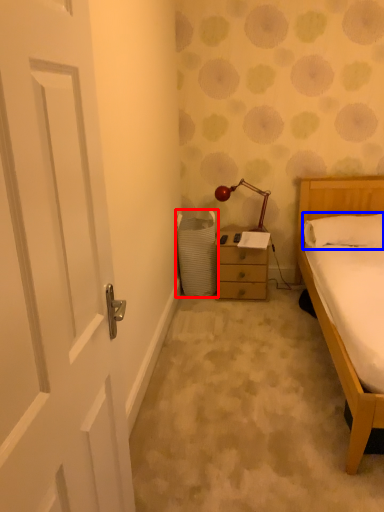
Question: Among these objects, which one is nearest to the camera, laundry basket (highlighted by a red box) or pillow (highlighted by a blue box)?

Choices:
 (A) laundry basket
 (B) pillow

Answer: (B)